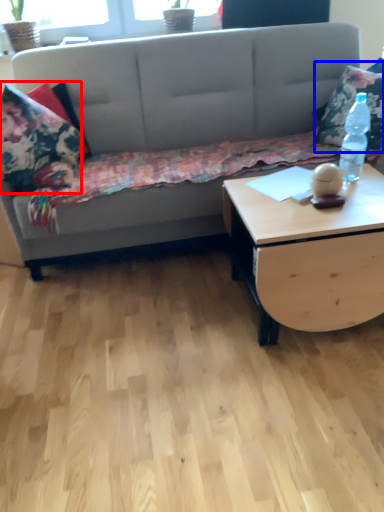
Question: Which of the following is the closest to the observer, pillow (highlighted by a red box) or throw pillow (highlighted by a blue box)?

Choices:
 (A) pillow
 (B) throw pillow

Answer: (A)